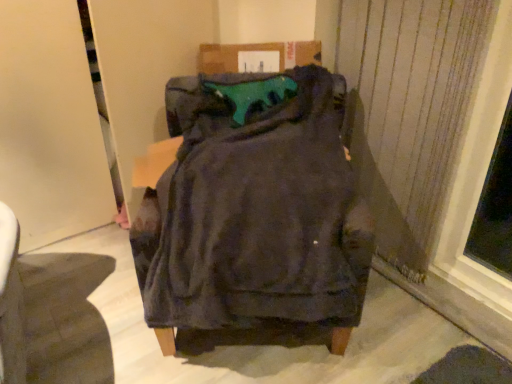
Question: Can you confirm if dark fabric chair at center is positioned to the right of teal fabric cushion at center?

Choices:
 (A) no
 (B) yes

Answer: (A)

Question: Is dark fabric chair at center aimed at teal fabric cushion at center?

Choices:
 (A) no
 (B) yes

Answer: (A)

Question: Is dark fabric chair at center behind teal fabric cushion at center?

Choices:
 (A) no
 (B) yes

Answer: (A)

Question: Can you confirm if dark fabric chair at center is wider than teal fabric cushion at center?

Choices:
 (A) no
 (B) yes

Answer: (B)

Question: Is dark fabric chair at center directly adjacent to teal fabric cushion at center?

Choices:
 (A) yes
 (B) no

Answer: (B)

Question: From a real-world perspective, relative to dark fabric chair at center, is satin fabric curtain at right vertically above or below?

Choices:
 (A) below
 (B) above

Answer: (B)

Question: From the image's perspective, is satin fabric curtain at right above or below dark fabric chair at center?

Choices:
 (A) below
 (B) above

Answer: (B)

Question: Is satin fabric curtain at right taller or shorter than dark fabric chair at center?

Choices:
 (A) short
 (B) tall

Answer: (B)

Question: Relative to dark fabric chair at center, is satin fabric curtain at right in front or behind?

Choices:
 (A) behind
 (B) front

Answer: (A)

Question: Relative to satin fabric curtain at right, is dark fabric chair at center in front or behind?

Choices:
 (A) behind
 (B) front

Answer: (B)

Question: Would you say dark fabric chair at center is to the left or to the right of satin fabric curtain at right in the picture?

Choices:
 (A) right
 (B) left

Answer: (B)

Question: From a real-world perspective, is dark fabric chair at center above or below satin fabric curtain at right?

Choices:
 (A) below
 (B) above

Answer: (A)

Question: Is dark fabric chair at center taller or shorter than satin fabric curtain at right?

Choices:
 (A) tall
 (B) short

Answer: (B)

Question: Considering the positions of dark fabric chair at center and teal fabric cushion at center in the image, is dark fabric chair at center bigger or smaller than teal fabric cushion at center?

Choices:
 (A) big
 (B) small

Answer: (A)

Question: From a real-world perspective, is dark fabric chair at center physically located above or below teal fabric cushion at center?

Choices:
 (A) above
 (B) below

Answer: (B)